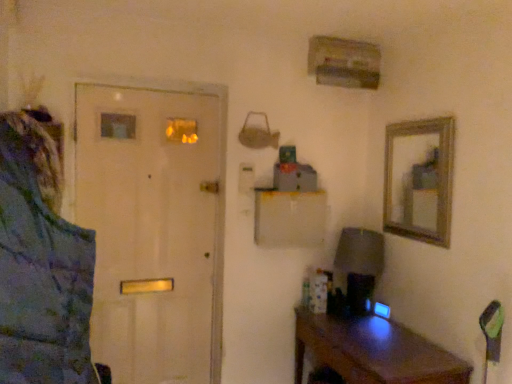
Question: From a real-world perspective, does white matte door at left stand above brown wooden desk at lower right?

Choices:
 (A) yes
 (B) no

Answer: (A)

Question: Is white matte door at left located outside brown wooden desk at lower right?

Choices:
 (A) no
 (B) yes

Answer: (B)

Question: Does white matte door at left have a lesser height compared to brown wooden desk at lower right?

Choices:
 (A) yes
 (B) no

Answer: (B)

Question: Considering the relative sizes of white matte door at left and brown wooden desk at lower right in the image provided, is white matte door at left taller than brown wooden desk at lower right?

Choices:
 (A) no
 (B) yes

Answer: (B)

Question: From the image's perspective, is white matte door at left below brown wooden desk at lower right?

Choices:
 (A) no
 (B) yes

Answer: (A)

Question: In terms of size, does blue textured jacket at left appear bigger or smaller than matte gray lampshade at right?

Choices:
 (A) small
 (B) big

Answer: (B)

Question: From a real-world perspective, relative to matte gray lampshade at right, is blue textured jacket at left vertically above or below?

Choices:
 (A) below
 (B) above

Answer: (B)

Question: Choose the correct answer: Is blue textured jacket at left inside matte gray lampshade at right or outside it?

Choices:
 (A) inside
 (B) outside

Answer: (B)

Question: From the image's perspective, is blue textured jacket at left above or below matte gray lampshade at right?

Choices:
 (A) above
 (B) below

Answer: (A)

Question: Is point (370, 291) closer or farther from the camera than point (313, 319)?

Choices:
 (A) farther
 (B) closer

Answer: (A)

Question: From their relative heights in the image, would you say matte gray lampshade at right is taller or shorter than brown wooden desk at lower right?

Choices:
 (A) tall
 (B) short

Answer: (B)

Question: From the image's perspective, is matte gray lampshade at right positioned above or below brown wooden desk at lower right?

Choices:
 (A) above
 (B) below

Answer: (A)

Question: Considering their positions, is matte gray lampshade at right located in front of or behind brown wooden desk at lower right?

Choices:
 (A) behind
 (B) front

Answer: (A)

Question: From their relative heights in the image, would you say blue textured jacket at left is taller or shorter than brown wooden desk at lower right?

Choices:
 (A) short
 (B) tall

Answer: (B)

Question: Considering the positions of point (14, 374) and point (466, 372), is point (14, 374) closer or farther from the camera than point (466, 372)?

Choices:
 (A) closer
 (B) farther

Answer: (A)